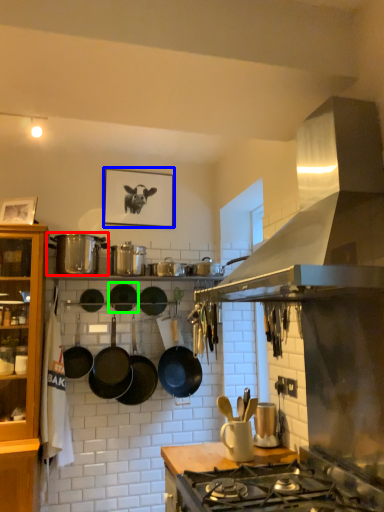
Question: Considering the real-world distances, which object is farthest from pot/pan (highlighted by a red box)? picture frame (highlighted by a blue box) or wok (highlighted by a green box)?

Choices:
 (A) picture frame
 (B) wok

Answer: (A)